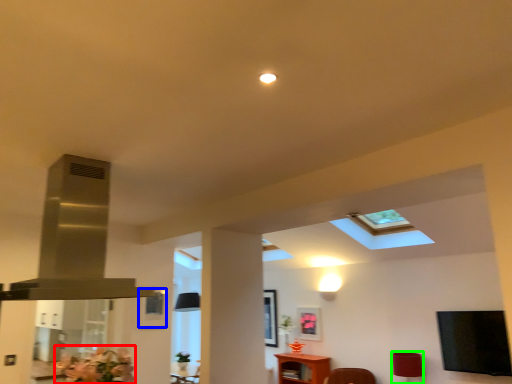
Question: Which object is positioned closest to flower (highlighted by a red box)? Select from picture frame (highlighted by a blue box) and lamp (highlighted by a green box).

Choices:
 (A) picture frame
 (B) lamp

Answer: (A)